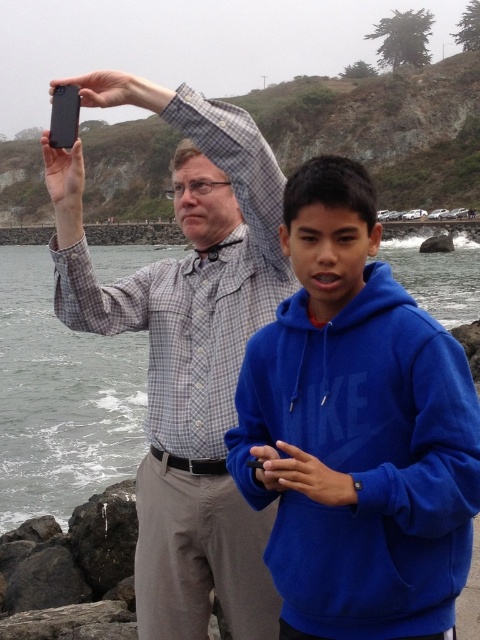
Can you confirm if blue fleece hoodie at center is taller than matte black shirt at upper left?

No, blue fleece hoodie at center is not taller than matte black shirt at upper left.

Is blue fleece hoodie at center wider than matte black shirt at upper left?

In fact, blue fleece hoodie at center might be narrower than matte black shirt at upper left.

Measure the distance between blue fleece hoodie at center and camera.

blue fleece hoodie at center is 10.46 meters away from camera.

Locate an element on the screen. This screenshot has width=480, height=640. blue fleece hoodie at center is located at coordinates (357, 429).

Can you confirm if matte black shirt at upper left is positioned to the left of gray water at lower left?

Incorrect, matte black shirt at upper left is not on the left side of gray water at lower left.

Is point (186, 120) positioned after point (8, 337)?

No, it is not.

This screenshot has width=480, height=640. What are the coordinates of `matte black shirt at upper left` in the screenshot? It's located at (188, 352).

This screenshot has width=480, height=640. What are the coordinates of `matte black shirt at upper left` in the screenshot? It's located at (188, 352).

Does blue fleece hoodie at center have a smaller size compared to gray water at lower left?

Yes, blue fleece hoodie at center is smaller than gray water at lower left.

Identify the location of blue fleece hoodie at center. (357, 429).